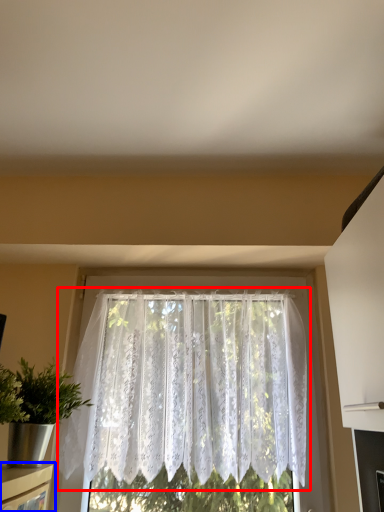
Question: Which object appears closest to the camera in this image, window (highlighted by a red box) or shelf (highlighted by a blue box)?

Choices:
 (A) window
 (B) shelf

Answer: (B)